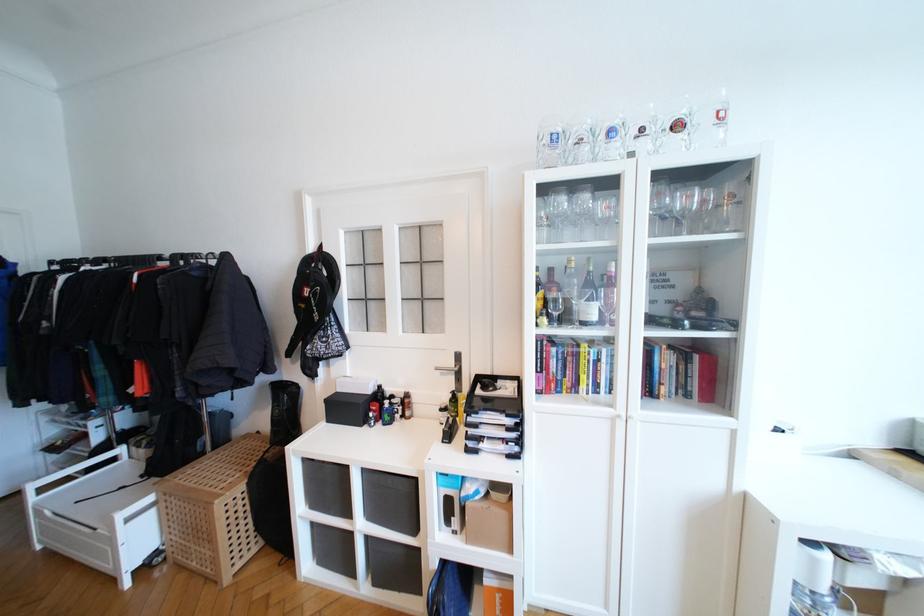
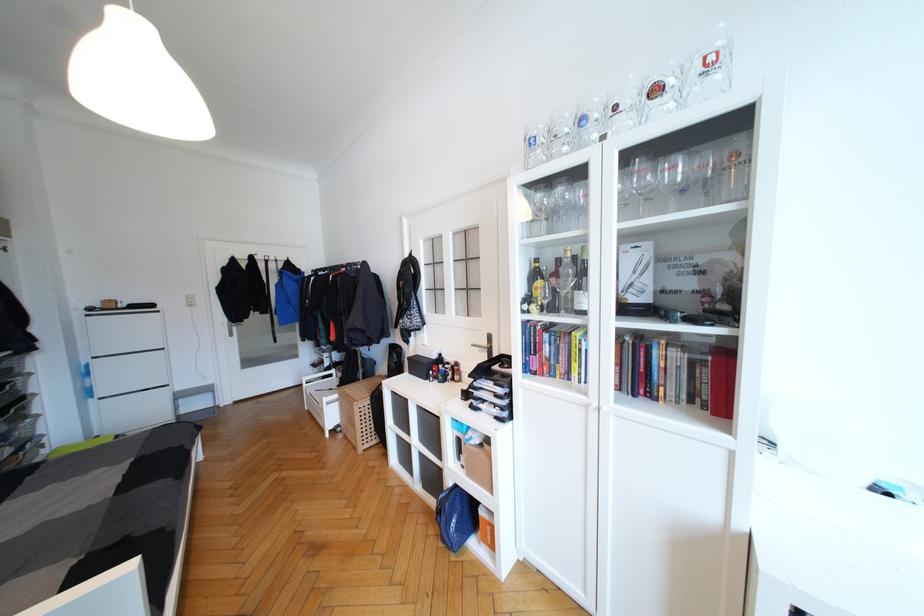
The point at (691, 200) is marked in the first image. Where is the corresponding point in the second image?

(679, 171)